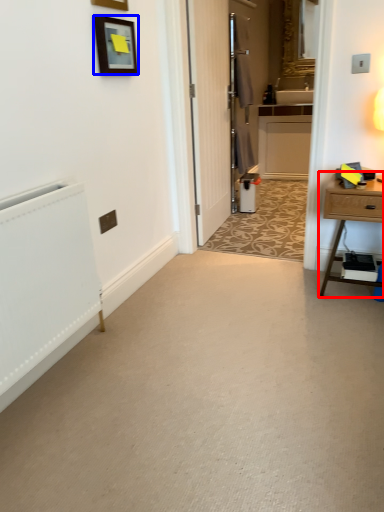
Question: Which of the following is the closest to the observer, nightstand (highlighted by a red box) or picture frame (highlighted by a blue box)?

Choices:
 (A) nightstand
 (B) picture frame

Answer: (B)